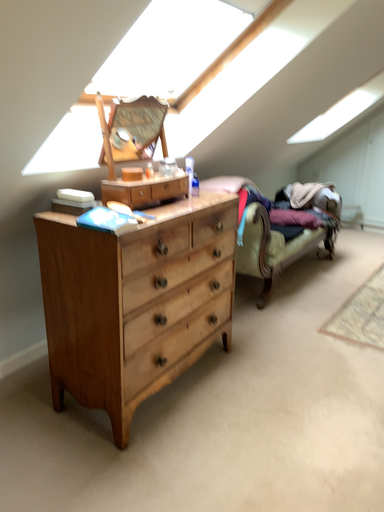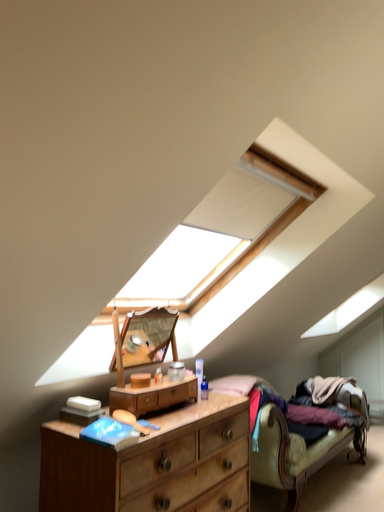
Question: How did the camera likely rotate when shooting the video?

Choices:
 (A) rotated upward
 (B) rotated downward

Answer: (A)